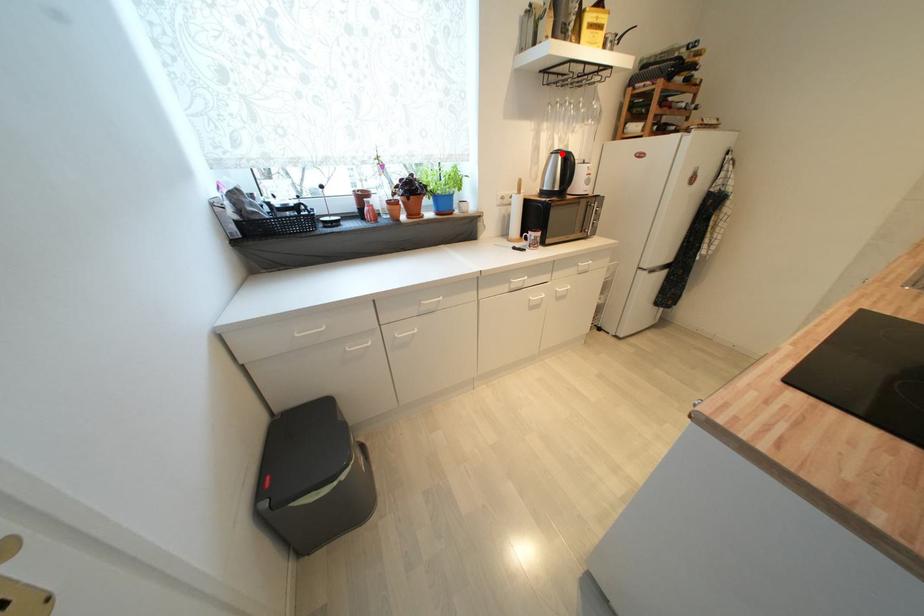
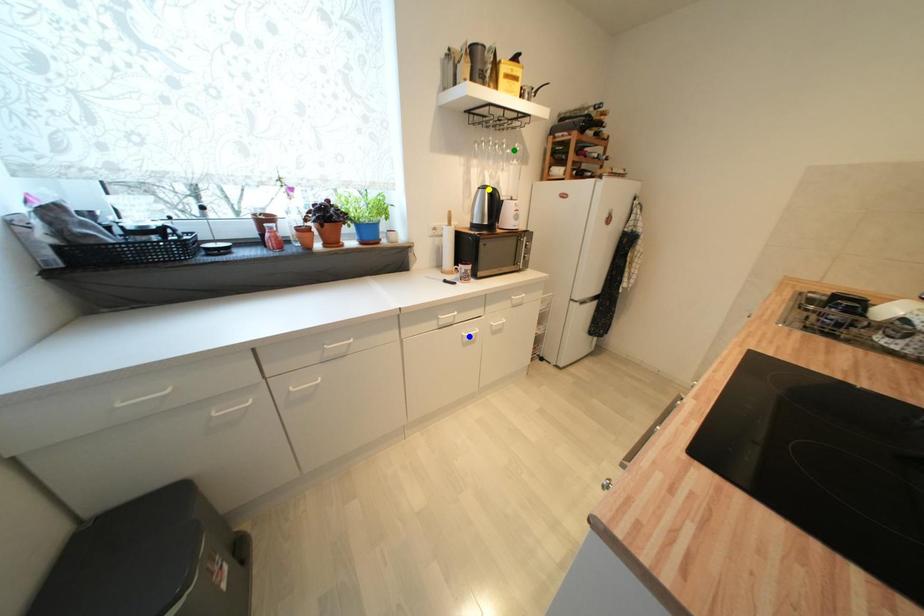
Question: I am providing you with two images of the same scene from different viewpoints. A red point is marked on the first image. You are given multiple points on the second image. Which mark in image 2 goes with the point in image 1?

Choices:
 (A) yellow point
 (B) blue point
 (C) green point

Answer: (A)